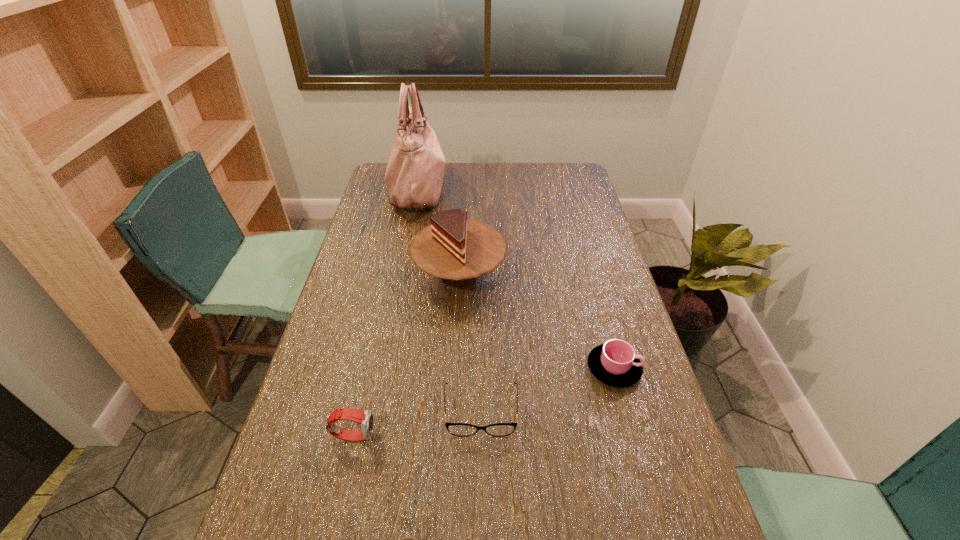
The width and height of the screenshot is (960, 540). Find the location of `the farthest object`. the farthest object is located at coordinates (414, 175).

I want to click on handbag, so click(414, 175).

Where is `the second tallest object`? The image size is (960, 540). the second tallest object is located at coordinates (458, 251).

Locate an element on the screen. cake is located at coordinates (458, 251).

Find the location of `the taller watch`. the taller watch is located at coordinates (365, 418).

I want to click on the farther watch, so click(365, 418).

Identify the location of cup. (614, 363).

The height and width of the screenshot is (540, 960). I want to click on the rightmost object, so click(x=614, y=363).

Locate an element on the screen. The width and height of the screenshot is (960, 540). spectacles is located at coordinates (457, 429).

The image size is (960, 540). Find the location of `free spot located 0.060m at the front of the farthest object with handles`. free spot located 0.060m at the front of the farthest object with handles is located at coordinates (462, 189).